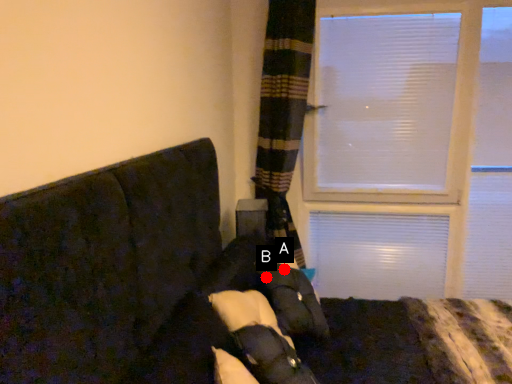
Question: Two points are circled on the image, labeled by A and B beside each circle. Which point is farther from the camera taking this photo?

Choices:
 (A) A is further
 (B) B is further

Answer: (A)